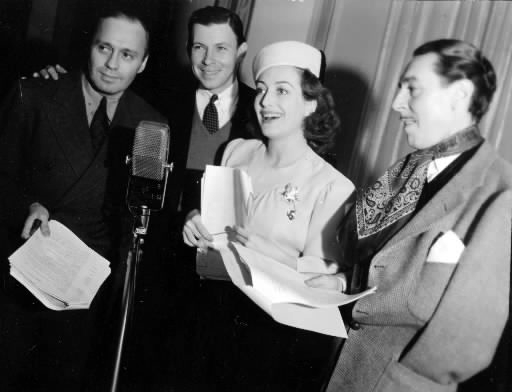
The image size is (512, 392). What are the coordinates of `wires` in the screenshot? It's located at (135, 278).